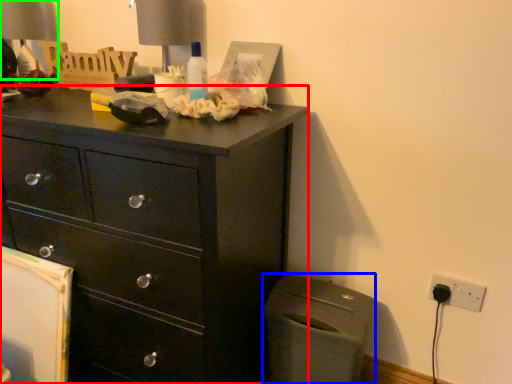
Question: Which object is the closest to the chest of drawers (highlighted by a red box)? Choose among these: cabinetry (highlighted by a blue box) or table lamp (highlighted by a green box).

Choices:
 (A) cabinetry
 (B) table lamp

Answer: (A)